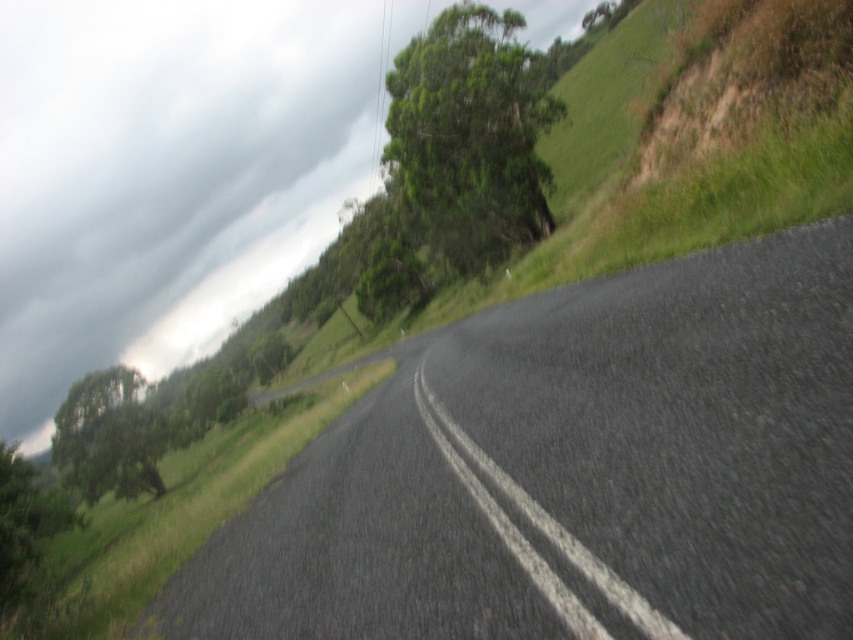
Is green leafy tree at upper left positioned at the back of gray asphalt road at center?

Yes, it is behind gray asphalt road at center.

Can you confirm if green leafy tree at upper left is wider than gray asphalt road at center?

Correct, the width of green leafy tree at upper left exceeds that of gray asphalt road at center.

Looking at this image, who is more forward, (119, 456) or (453, 436)?

Point (453, 436) is more forward.

At what (x,y) coordinates should I click in order to perform the action: click on green leafy tree at upper left. Please return your answer as a coordinate pair (x, y). Looking at the image, I should click on (x=108, y=436).

Between green leafy tree at upper center and green leafy tree at upper left, which one is positioned lower?

green leafy tree at upper left

Which of these two, green leafy tree at upper center or green leafy tree at upper left, stands taller?

Standing taller between the two is green leafy tree at upper center.

Who is more forward, (491, 124) or (120, 493)?

Point (491, 124)

Where is `green leafy tree at upper center`? The width and height of the screenshot is (853, 640). green leafy tree at upper center is located at coordinates pos(469,134).

Does green leafy tree at upper center appear on the left side of gray asphalt road at center?

Incorrect, green leafy tree at upper center is not on the left side of gray asphalt road at center.

Is green leafy tree at upper center below gray asphalt road at center?

No, green leafy tree at upper center is not below gray asphalt road at center.

The width and height of the screenshot is (853, 640). What are the coordinates of `green leafy tree at upper center` in the screenshot? It's located at (469, 134).